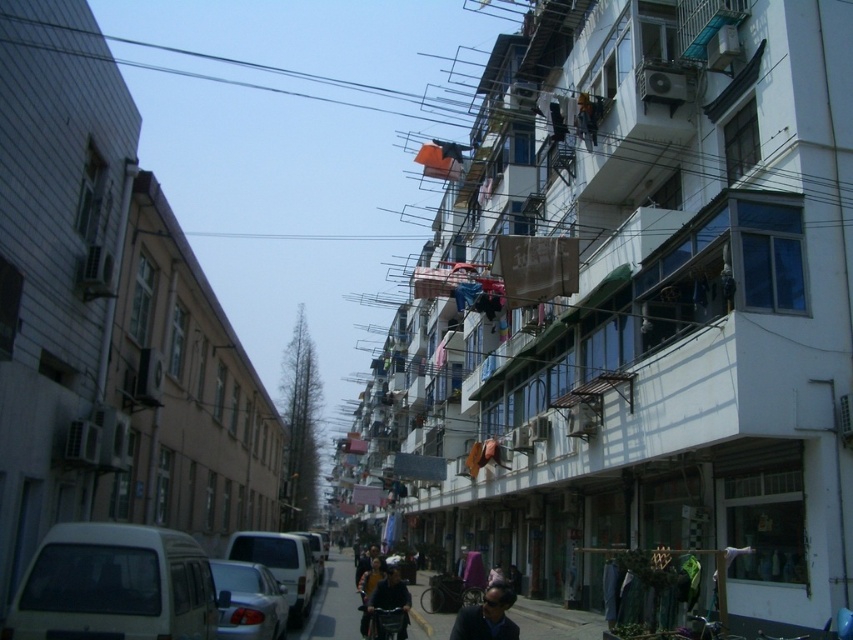
Question: Among these objects, which one is nearest to the camera?

Choices:
 (A) dark blue jacket at center
 (B) dark blue fabric at lower center

Answer: (B)

Question: Is silver metallic car at lower left above dark blue fabric at lower center?

Choices:
 (A) no
 (B) yes

Answer: (B)

Question: Considering the real-world distances, which object is closest to the white matte van at lower left?

Choices:
 (A) silver metallic van at center
 (B) silver metallic car at lower left
 (C) black wire at upper left

Answer: (B)

Question: Is white matte van at lower left wider than dark blue jacket at center?

Choices:
 (A) yes
 (B) no

Answer: (A)

Question: Considering the relative positions of white matte van at lower left and black wire at upper left in the image provided, where is white matte van at lower left located with respect to black wire at upper left?

Choices:
 (A) below
 (B) above

Answer: (A)

Question: Which point appears closest to the camera in this image?

Choices:
 (A) (376, 625)
 (B) (230, 64)

Answer: (A)